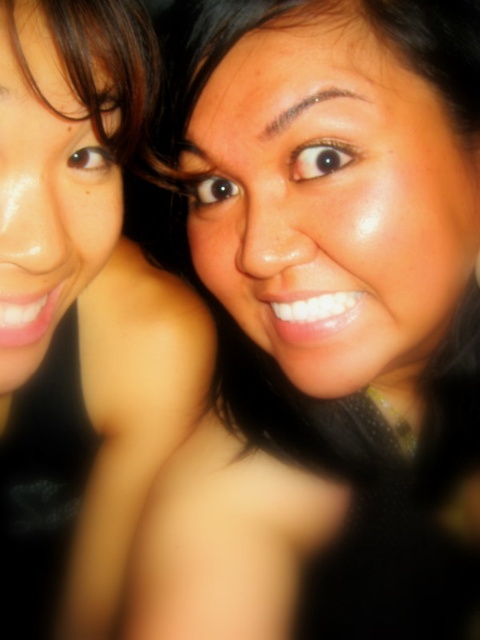
Question: Is smooth skin face at upper right thinner than matte skin at upper center?

Choices:
 (A) yes
 (B) no

Answer: (B)

Question: Which object is closer to the camera taking this photo?

Choices:
 (A) matte skin at upper center
 (B) smooth skin face at upper right

Answer: (A)

Question: Is smooth skin face at upper right to the right of matte skin at upper center from the viewer's perspective?

Choices:
 (A) no
 (B) yes

Answer: (B)

Question: Is the position of smooth skin face at upper right less distant than that of matte skin at upper center?

Choices:
 (A) yes
 (B) no

Answer: (B)